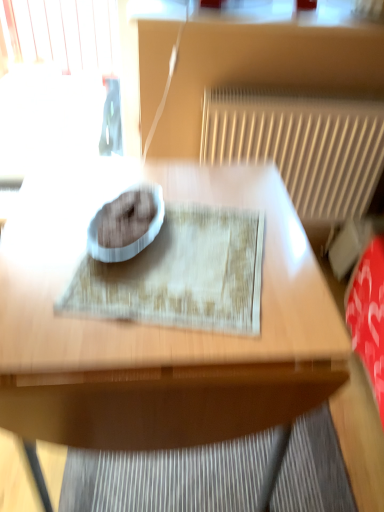
I want to click on free location above textured beige mat at center (from a real-world perspective), so click(174, 251).